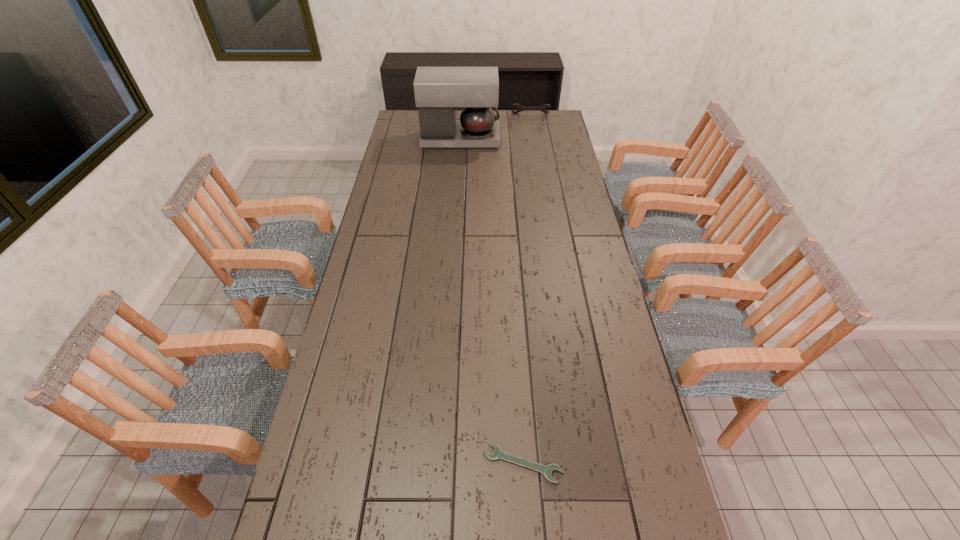
In order to click on free space that satisfies the following two spatial constraints: 1. on the carafe side of the shorter wrench; 2. on the right side of the tallest object in this screenshot , I will do `click(440, 464)`.

Where is `vacant position in the image that satisfies the following two spatial constraints: 1. on the carafe side of the second nearest object; 2. on the right side of the shorter wrench`? Image resolution: width=960 pixels, height=540 pixels. vacant position in the image that satisfies the following two spatial constraints: 1. on the carafe side of the second nearest object; 2. on the right side of the shorter wrench is located at coordinates (440, 464).

The height and width of the screenshot is (540, 960). Identify the location of free space that satisfies the following two spatial constraints: 1. on the open ends of the farther wrench; 2. on the carafe side of the coffee maker. (535, 139).

Find the location of a particular element. This screenshot has height=540, width=960. free region that satisfies the following two spatial constraints: 1. on the carafe side of the nearer wrench; 2. on the right side of the second farthest object is located at coordinates coord(440,464).

I want to click on free region that satisfies the following two spatial constraints: 1. on the carafe side of the coffee maker; 2. on the back side of the shorter wrench, so click(x=440, y=464).

You are a GUI agent. You are given a task and a screenshot of the screen. Output one action in this format:
    pyautogui.click(x=<x>, y=<y>)
    Task: Click on the vacant area in the image that satisfies the following two spatial constraints: 1. on the back side of the nearest object; 2. on the carafe side of the coffee maker
    This screenshot has width=960, height=540.
    Given the screenshot: What is the action you would take?
    pyautogui.click(x=501, y=139)

You are a GUI agent. You are given a task and a screenshot of the screen. Output one action in this format:
    pyautogui.click(x=<x>, y=<y>)
    Task: Click on the vacant space that satisfies the following two spatial constraints: 1. on the open ends of the farthest object; 2. on the carafe side of the tallest object
    The image size is (960, 540).
    Given the screenshot: What is the action you would take?
    535,139